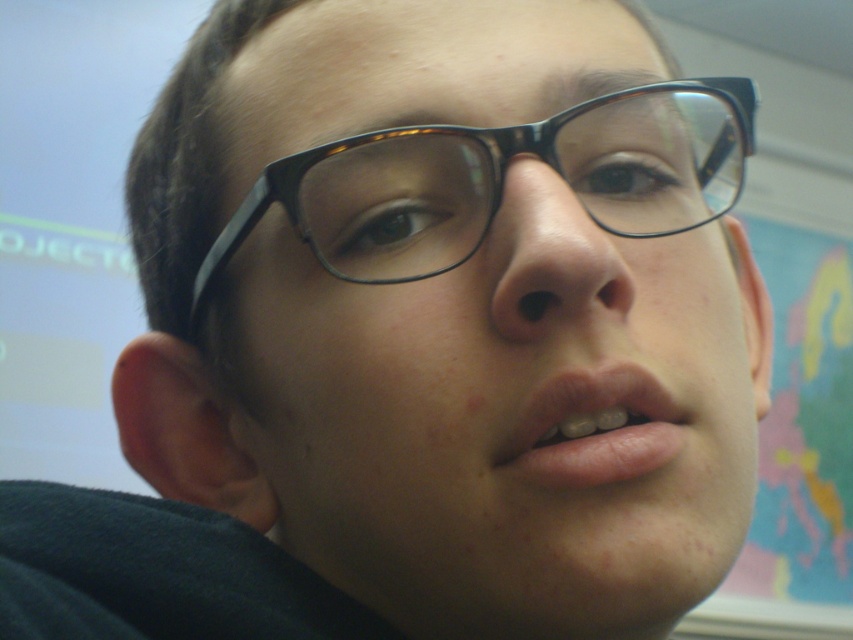
You are a photographer trying to capture a close shot of the black acetate glasses at center. The camera lens has a minimum focusing distance of 12 inches. Can you take the photo without moving the glasses?

The black acetate glasses at center are 12.29 inches away from the viewer, which is slightly beyond the camera lens minimum focusing distance of 12 inches. Therefore, you cannot take the photo without moving the glasses closer.

You are a makeup artist preparing for a client who wants to ensure their glasses won not interfere with their lip makeup. The client has black acetate glasses at center and pink matte lips at center. Based on the image, what is the minimum distance you should maintain between the glasses and the lips to prevent smudging?

The black acetate glasses at center are 3.13 inches away from the pink matte lips at center, so maintaining at least 3.13 inches of distance between them would prevent smudging.